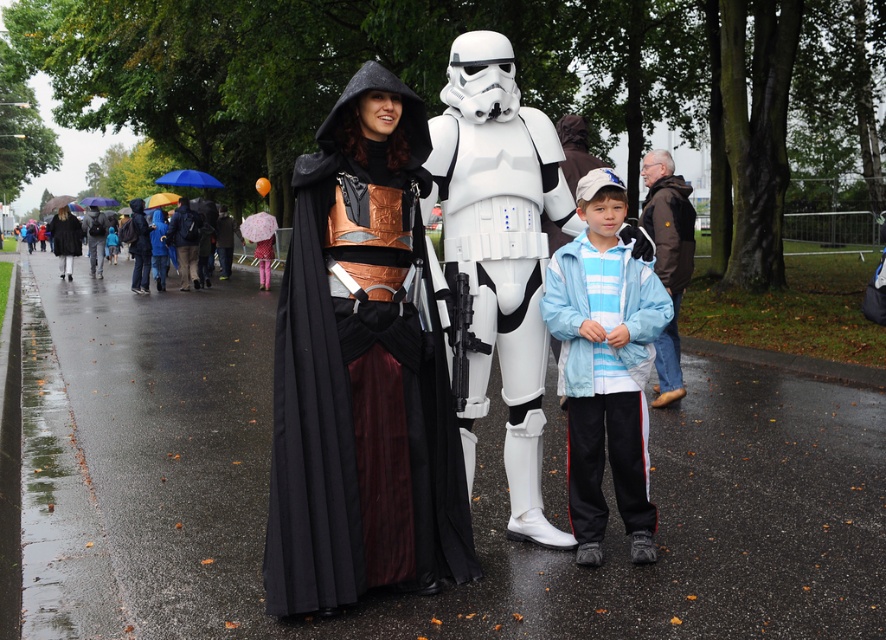
You are a photographer trying to capture a wide shot of the two umbrellas, the yellow fabric umbrella at upper center and the blue fabric umbrella at upper center, in the scene. Your camera has a maximum focus range of 8 meters. Can you fit both umbrellas in the frame without moving the camera?

The yellow fabric umbrella at upper center and blue fabric umbrella at upper center are 7.73 meters apart, so yes, you can fit both in the frame since the distance between them is within the camera maximum focus range of 8 meters.

You are organizing a costume parade and need to ensure that all participants can fit through a narrow corridor. Given the presence of the matte black cloak at left and the yellow fabric umbrella at upper center, which item would you be more concerned about fitting through the corridor?

The yellow fabric umbrella at upper center occupies more space than the matte black cloak at left, so you should be more concerned about the yellow fabric umbrella at upper center fitting through the corridor.

What is located at the coordinates point (65, 237)?

The location at point (65, 237) is occupied by the matte black cloak at left.